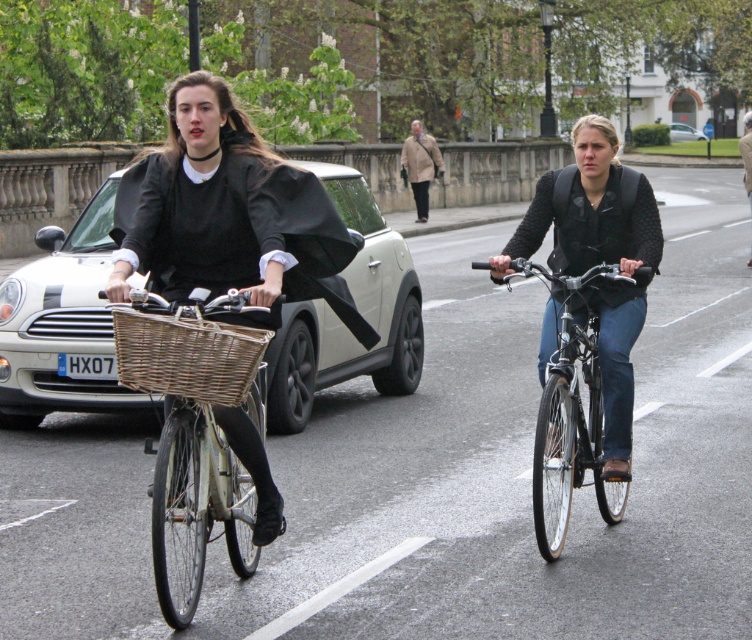
You are a delivery person who needs to place a package in the wooden wicker basket at left while riding a bicycle. The package is 2.5 meters long. Can you safely carry it without it touching the matte black jacket at right?

The distance between the wooden wicker basket at left and matte black jacket at right is 2.65 meters. Since the package is 2.5 meters long, it can be safely carried without touching the matte black jacket at right as there is enough space between them.

You are a pedestrian standing on the sidewalk and see the light brown leather coat at center and the white matte car at center in the middle of the road. Which object takes up more space in the scene?

The white matte car at center takes up more space in the scene than the light brown leather coat at center because the light brown leather coat at center occupies less space than white matte car at center.

You are a delivery person who needs to place a package in the basket that is higher up. Which basket should you use between the wooden wicker basket at left and the woven brown basket at left?

The woven brown basket at left is higher up, so you should place the package in the woven brown basket at left.